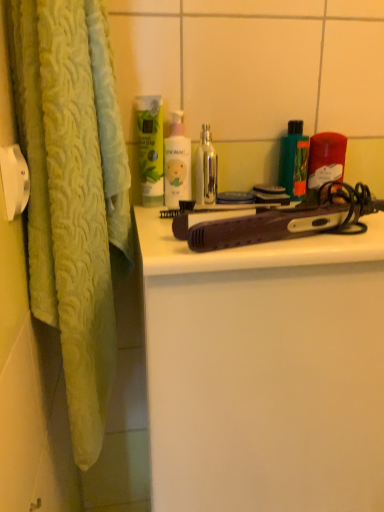
Identify the location of vacant area on top of purple plastic hair straightener at center (from a real-world perspective). (276, 205).